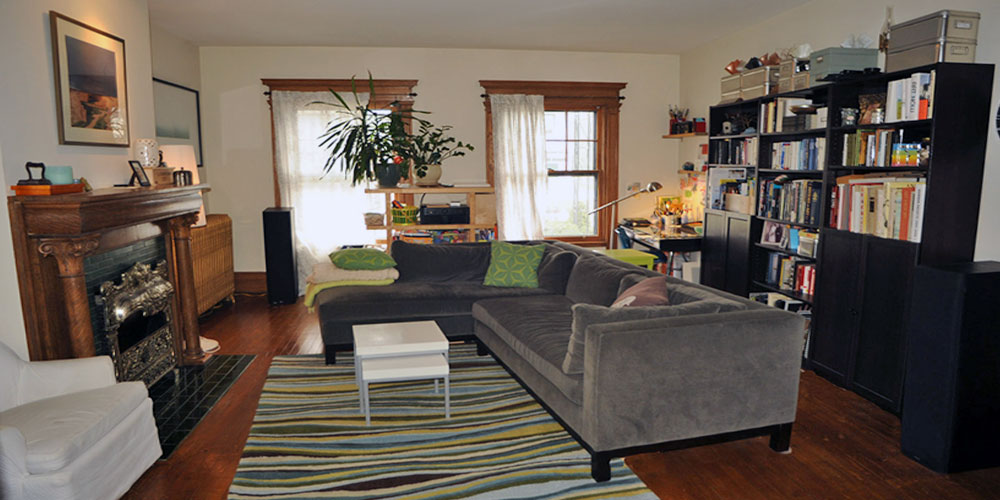
The height and width of the screenshot is (500, 1000). Find the location of `sofa`. sofa is located at coordinates (537, 345).